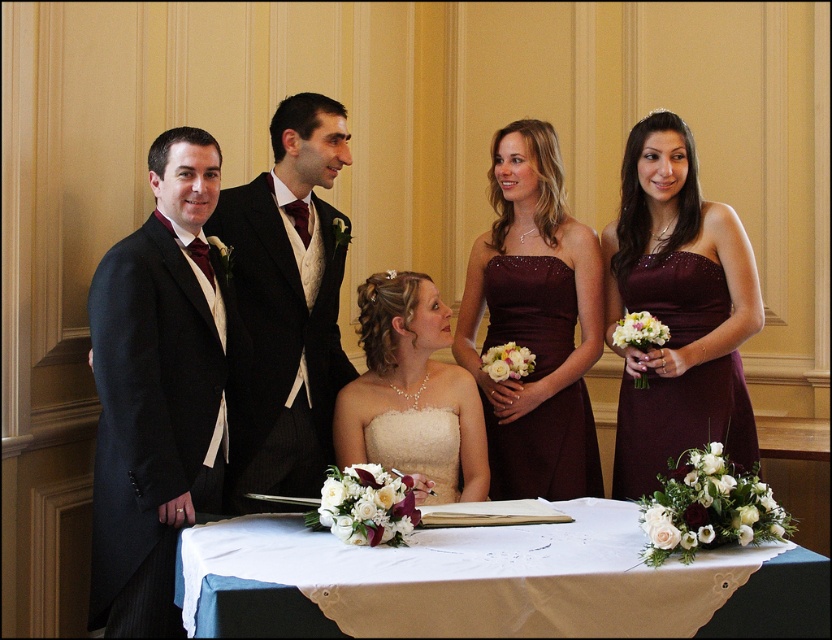
Does white cloth at center have a greater height compared to matte burgundy dress at center?

No.

Locate an element on the screen. white cloth at center is located at coordinates tap(479, 577).

Between point (474, 528) and point (563, 413), which one is positioned behind?

The point (563, 413) is behind.

You are a GUI agent. You are given a task and a screenshot of the screen. Output one action in this format:
    pyautogui.click(x=<x>, y=<y>)
    Task: Click on the white cloth at center
    This screenshot has width=832, height=640.
    Given the screenshot: What is the action you would take?
    pyautogui.click(x=479, y=577)

Does white satin dress at center appear over ivory lace dress at center?

Yes.

Measure the distance between white satin dress at center and ivory lace dress at center.

The distance of white satin dress at center from ivory lace dress at center is 3.54 inches.

You are a GUI agent. You are given a task and a screenshot of the screen. Output one action in this format:
    pyautogui.click(x=<x>, y=<y>)
    Task: Click on the white satin dress at center
    The width and height of the screenshot is (832, 640).
    Given the screenshot: What is the action you would take?
    pyautogui.click(x=410, y=380)

How distant is matte burgundy dress at center from white satin dress at center?

A distance of 22.78 centimeters exists between matte burgundy dress at center and white satin dress at center.

You are a GUI agent. You are given a task and a screenshot of the screen. Output one action in this format:
    pyautogui.click(x=<x>, y=<y>)
    Task: Click on the matte burgundy dress at center
    
    Given the screenshot: What is the action you would take?
    pyautogui.click(x=541, y=259)

Is point (467, 474) closer to camera compared to point (394, 392)?

Yes, point (467, 474) is closer to viewer.

You are a GUI agent. You are given a task and a screenshot of the screen. Output one action in this format:
    pyautogui.click(x=<x>, y=<y>)
    Task: Click on the matte burgundy dress at center
    This screenshot has width=832, height=640.
    Given the screenshot: What is the action you would take?
    pyautogui.click(x=541, y=259)